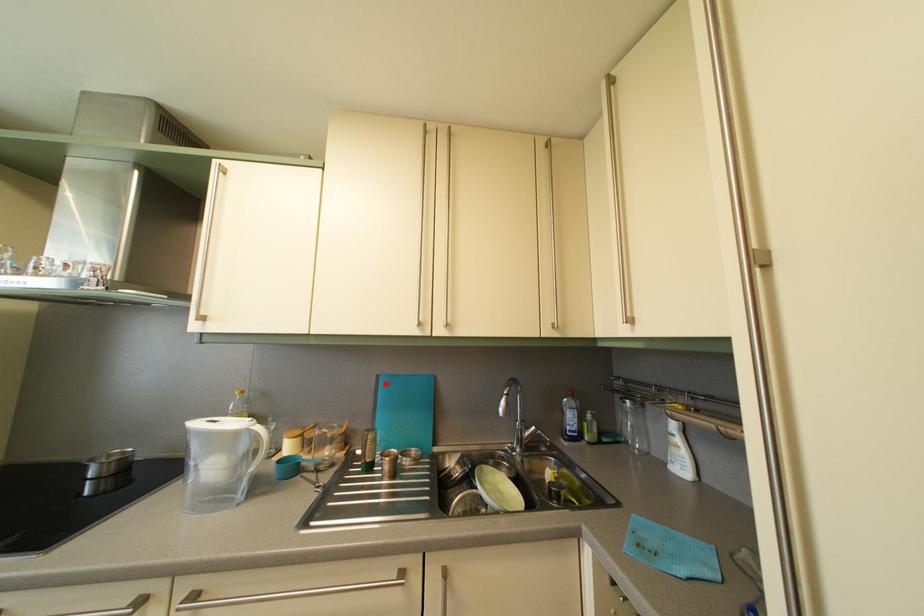
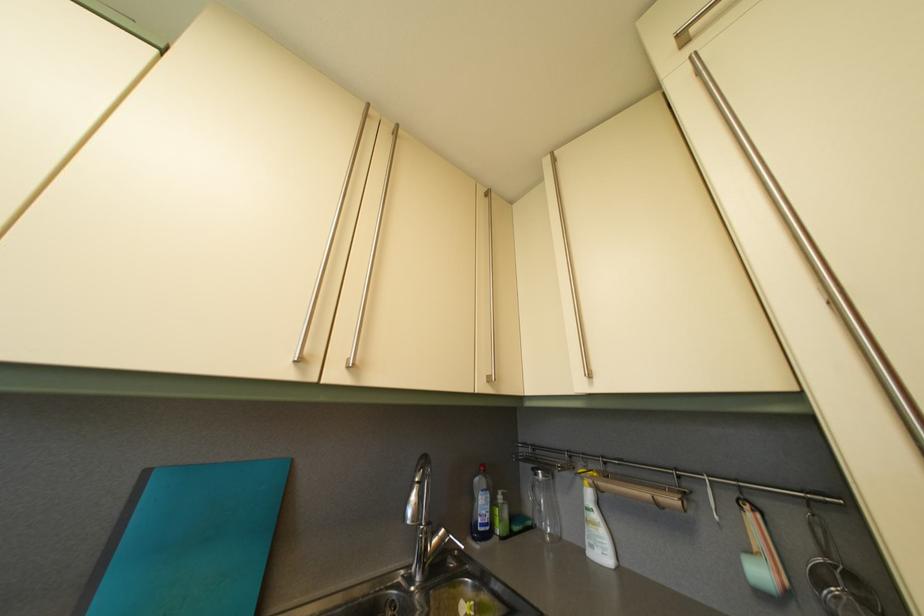
Find the pixel in the second image that matches the highlighted location in the first image.

(154, 480)